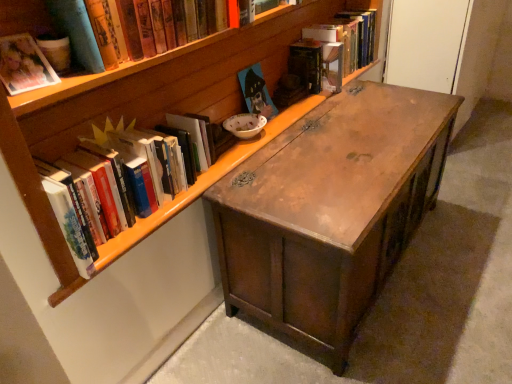
Question: Based on their positions, is hardcover book at upper center, which is the 5th book from front to back, located to the left or right of matte wooden painting at center, the third book in the back-to-front sequence?

Choices:
 (A) right
 (B) left

Answer: (A)

Question: In the image, is hardcover book at upper center, which is the second book in back-to-front order, positioned in front of or behind matte wooden painting at center, the third book in the back-to-front sequence?

Choices:
 (A) behind
 (B) front

Answer: (A)

Question: Based on their relative distances, which object is nearer to the wooden bookcase at upper center?

Choices:
 (A) matte wooden painting at center, acting as the 4th book starting from the front
 (B) matte cardboard book at upper left, the sixth book viewed from the back
 (C) wooden desk at center
 (D) hardcover books at left, which is the third book in front-to-back order
 (E) hardcover book at upper right, which ranks as the first book in back-to-front order

Answer: (D)

Question: Which is nearer to the hardcover book at upper center, which is the second book in back-to-front order?

Choices:
 (A) wooden desk at center
 (B) wooden bookcase at upper center
 (C) hardcover book at upper right, which ranks as the first book in back-to-front order
 (D) matte cardboard book at upper left, the sixth book viewed from the back
 (E) matte paper photo album at upper left, which is the fifth book from back to front

Answer: (C)